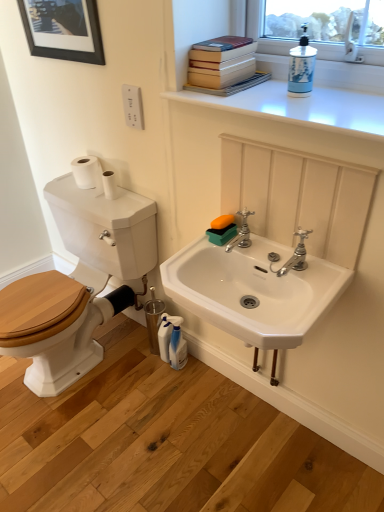
Question: From the image's perspective, does black matte picture frame at upper left appear lower than silver metallic faucet at center, marked as the second tap in a right-to-left arrangement?

Choices:
 (A) yes
 (B) no

Answer: (B)

Question: Considering the relative sizes of black matte picture frame at upper left and silver metallic faucet at center, which is counted as the first tap, starting from the left, in the image provided, is black matte picture frame at upper left thinner than silver metallic faucet at center, which is counted as the first tap, starting from the left,?

Choices:
 (A) no
 (B) yes

Answer: (B)

Question: Considering the relative positions of black matte picture frame at upper left and silver metallic faucet at center, marked as the second tap in a right-to-left arrangement, in the image provided, is black matte picture frame at upper left behind silver metallic faucet at center, marked as the second tap in a right-to-left arrangement,?

Choices:
 (A) no
 (B) yes

Answer: (B)

Question: Can you confirm if black matte picture frame at upper left is positioned to the right of silver metallic faucet at center, marked as the second tap in a right-to-left arrangement?

Choices:
 (A) no
 (B) yes

Answer: (A)

Question: Does black matte picture frame at upper left turn towards silver metallic faucet at center, marked as the second tap in a right-to-left arrangement?

Choices:
 (A) yes
 (B) no

Answer: (B)

Question: Can you confirm if black matte picture frame at upper left is smaller than silver metallic faucet at center, marked as the second tap in a right-to-left arrangement?

Choices:
 (A) no
 (B) yes

Answer: (A)

Question: Does woodenmaterial/texturetoilet at left have a larger size compared to white glossy counter top at upper center?

Choices:
 (A) no
 (B) yes

Answer: (B)

Question: From a real-world perspective, is woodenmaterial/texturetoilet at left on top of white glossy counter top at upper center?

Choices:
 (A) no
 (B) yes

Answer: (A)

Question: Is woodenmaterial/texturetoilet at left wider than white glossy counter top at upper center?

Choices:
 (A) yes
 (B) no

Answer: (A)

Question: Considering the relative sizes of woodenmaterial/texturetoilet at left and white glossy counter top at upper center in the image provided, is woodenmaterial/texturetoilet at left shorter than white glossy counter top at upper center?

Choices:
 (A) yes
 (B) no

Answer: (B)

Question: Is woodenmaterial/texturetoilet at left positioned before white glossy counter top at upper center?

Choices:
 (A) yes
 (B) no

Answer: (B)

Question: Is woodenmaterial/texturetoilet at left touching white glossy counter top at upper center?

Choices:
 (A) no
 (B) yes

Answer: (A)

Question: Does white ceramic sink at center have a lesser width compared to white glossy counter top at upper center?

Choices:
 (A) yes
 (B) no

Answer: (A)